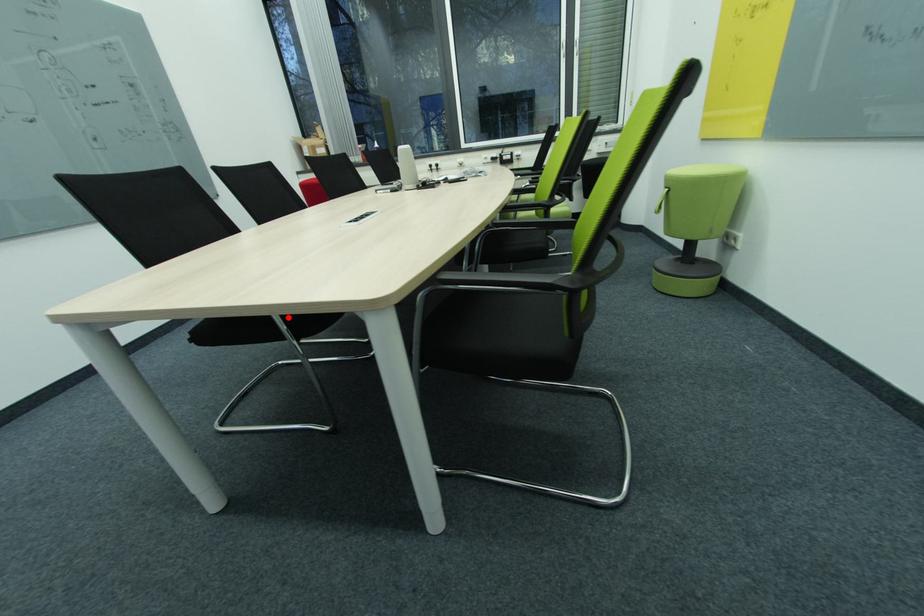
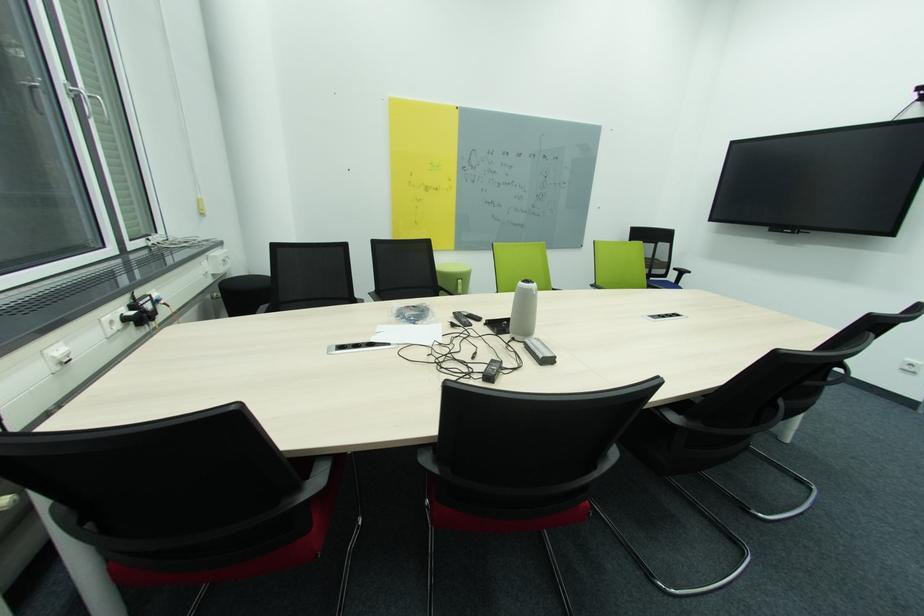
Question: I am providing you with two images of the same scene from different viewpoints. A red point is marked on the first image. Is the red point's position out of view in image 2?

Choices:
 (A) Yes
 (B) No

Answer: (A)